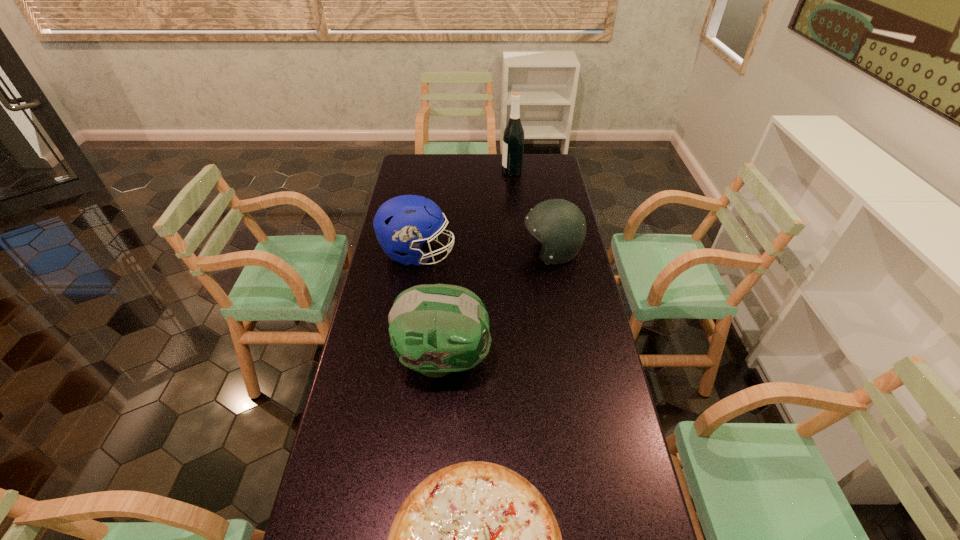
You are a GUI agent. You are given a task and a screenshot of the screen. Output one action in this format:
    pyautogui.click(x=<x>, y=<y>)
    Task: Click on the farthest object
    The height and width of the screenshot is (540, 960).
    Given the screenshot: What is the action you would take?
    pyautogui.click(x=513, y=138)

Where is `the tallest object`? the tallest object is located at coordinates (513, 138).

The image size is (960, 540). Find the location of `the nearest football helmet`. the nearest football helmet is located at coordinates (435, 329).

Where is `the rightmost football helmet`? the rightmost football helmet is located at coordinates (559, 225).

This screenshot has height=540, width=960. I want to click on blank space located 0.090m on the label of the wine bottle, so click(483, 172).

Locate an element on the screen. This screenshot has width=960, height=540. vacant space positioned on the label of the wine bottle is located at coordinates (448, 172).

Identify the location of free space located 0.400m on the label of the wine bottle. (420, 172).

This screenshot has height=540, width=960. In order to click on free space located 0.250m on the visor of the second nearest object in this screenshot , I will do `click(573, 360)`.

In order to click on blank area located 0.060m at the face opening of the rightmost football helmet in this screenshot , I will do `click(506, 252)`.

Identify the location of vacant space located 0.070m at the face opening of the rightmost football helmet. The height and width of the screenshot is (540, 960). (504, 252).